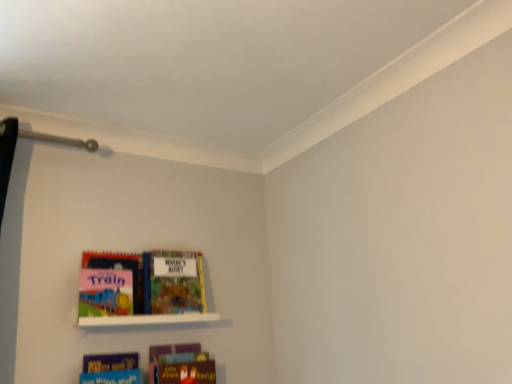
Question: Is multicolored cardboard book at center, positioned as the second book in top-to-bottom order, to the right of matte board book at left, which ranks as the fourth book in bottom-to-top order, from the viewer's perspective?

Choices:
 (A) no
 (B) yes

Answer: (B)

Question: Are multicolored cardboard book at center, which appears as the third book when ordered from the bottom, and matte board book at left, which ranks as the fourth book in bottom-to-top order, located far from each other?

Choices:
 (A) yes
 (B) no

Answer: (B)

Question: Is multicolored cardboard book at center, which appears as the third book when ordered from the bottom, looking in the opposite direction of matte board book at left, which ranks as the fourth book in bottom-to-top order?

Choices:
 (A) no
 (B) yes

Answer: (A)

Question: Does multicolored cardboard book at center, which appears as the third book when ordered from the bottom, come in front of matte board book at left, which ranks as the fourth book in bottom-to-top order?

Choices:
 (A) yes
 (B) no

Answer: (B)

Question: Does multicolored cardboard book at center, which appears as the third book when ordered from the bottom, come behind matte board book at left, the 1th book viewed from the top?

Choices:
 (A) yes
 (B) no

Answer: (A)

Question: In terms of size, does multicolored cardboard book at center, positioned as the second book in top-to-bottom order, appear bigger or smaller than blue matte book at lower center, which is the 2th book from bottom to top?

Choices:
 (A) small
 (B) big

Answer: (B)

Question: From the image's perspective, is multicolored cardboard book at center, positioned as the second book in top-to-bottom order, positioned above or below blue matte book at lower center, placed as the third book when sorted from top to bottom?

Choices:
 (A) above
 (B) below

Answer: (A)

Question: Is multicolored cardboard book at center, positioned as the second book in top-to-bottom order, inside or outside of blue matte book at lower center, which is the 2th book from bottom to top?

Choices:
 (A) outside
 (B) inside

Answer: (A)

Question: In the image, is multicolored cardboard book at center, positioned as the second book in top-to-bottom order, on the left side or the right side of blue matte book at lower center, which is the 2th book from bottom to top?

Choices:
 (A) right
 (B) left

Answer: (A)

Question: From the image's perspective, is blue matte book at lower center, which is the 2th book from bottom to top, above or below matte board book at left, which ranks as the fourth book in bottom-to-top order?

Choices:
 (A) below
 (B) above

Answer: (A)

Question: Would you say blue matte book at lower center, which is the 2th book from bottom to top, is inside or outside matte board book at left, the 1th book viewed from the top?

Choices:
 (A) inside
 (B) outside

Answer: (B)

Question: Is blue matte book at lower center, placed as the third book when sorted from top to bottom, taller or shorter than matte board book at left, the 1th book viewed from the top?

Choices:
 (A) tall
 (B) short

Answer: (B)

Question: Is point (115, 375) closer or farther from the camera than point (118, 274)?

Choices:
 (A) closer
 (B) farther

Answer: (A)

Question: Is matte board book at left, the 1th book viewed from the top, wider or thinner than multicolored cardboard book at center, which appears as the third book when ordered from the bottom?

Choices:
 (A) thin
 (B) wide

Answer: (A)

Question: In the image, is matte board book at left, the 1th book viewed from the top, positioned in front of or behind multicolored cardboard book at center, positioned as the second book in top-to-bottom order?

Choices:
 (A) behind
 (B) front

Answer: (B)